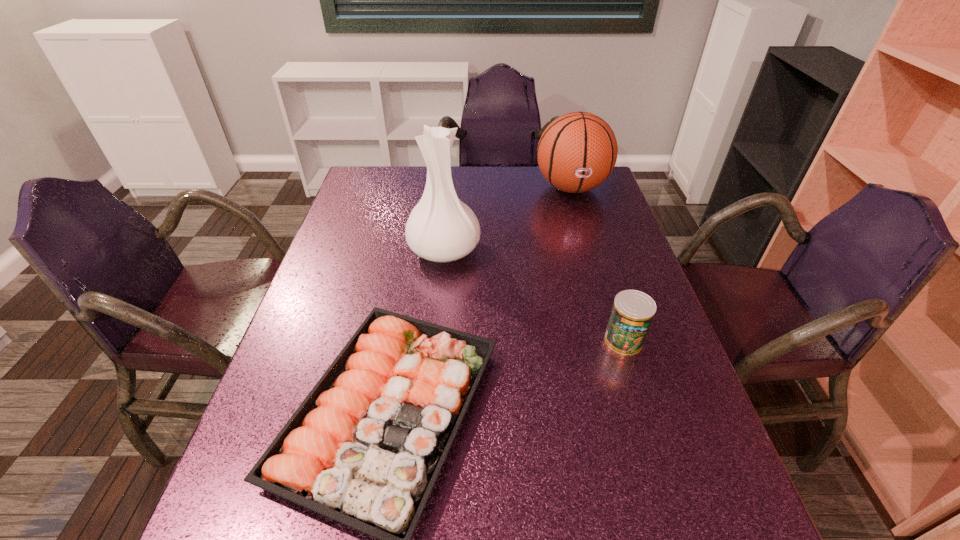
Find the location of a particular element. The height and width of the screenshot is (540, 960). can located in the right edge section of the desktop is located at coordinates click(633, 311).

The height and width of the screenshot is (540, 960). I want to click on object at the far right corner, so click(577, 152).

This screenshot has width=960, height=540. Identify the location of vacant region at the far edge of the desktop. (483, 179).

This screenshot has height=540, width=960. Find the location of `vacant area at the left edge of the desktop`. vacant area at the left edge of the desktop is located at coordinates (340, 256).

Locate an element on the screen. The width and height of the screenshot is (960, 540). free space at the right edge is located at coordinates (602, 252).

The image size is (960, 540). In order to click on vacant space at the far left corner of the desktop in this screenshot , I will do `click(401, 177)`.

In the image, there is a desktop. Identify the location of vacant space at the far right corner. Image resolution: width=960 pixels, height=540 pixels. (601, 197).

You are a GUI agent. You are given a task and a screenshot of the screen. Output one action in this format:
    pyautogui.click(x=<x>, y=<y>)
    Task: Click on the unoccupied position between the tallest object and the farthest object
    This screenshot has height=540, width=960.
    Given the screenshot: What is the action you would take?
    pyautogui.click(x=508, y=219)

The width and height of the screenshot is (960, 540). Identify the location of vacant point located between the vase and the third shortest object. (508, 219).

Find the location of a particular element. free area in between the basketball and the tallest object is located at coordinates (508, 219).